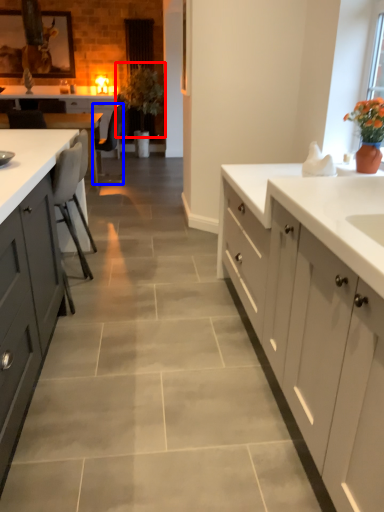
Question: Which of the following is the closest to the observer, plant (highlighted by a red box) or chair (highlighted by a blue box)?

Choices:
 (A) plant
 (B) chair

Answer: (B)